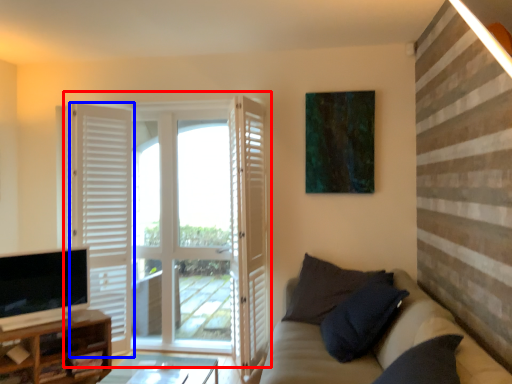
Question: Which point is closer to the camera, door (highlighted by a red box) or door (highlighted by a blue box)?

Choices:
 (A) door
 (B) door

Answer: (B)